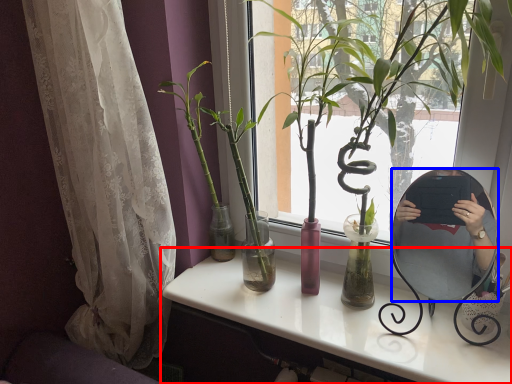
Question: Among these objects, which one is nearest to the camera, desk (highlighted by a red box) or mirror (highlighted by a blue box)?

Choices:
 (A) desk
 (B) mirror

Answer: (A)